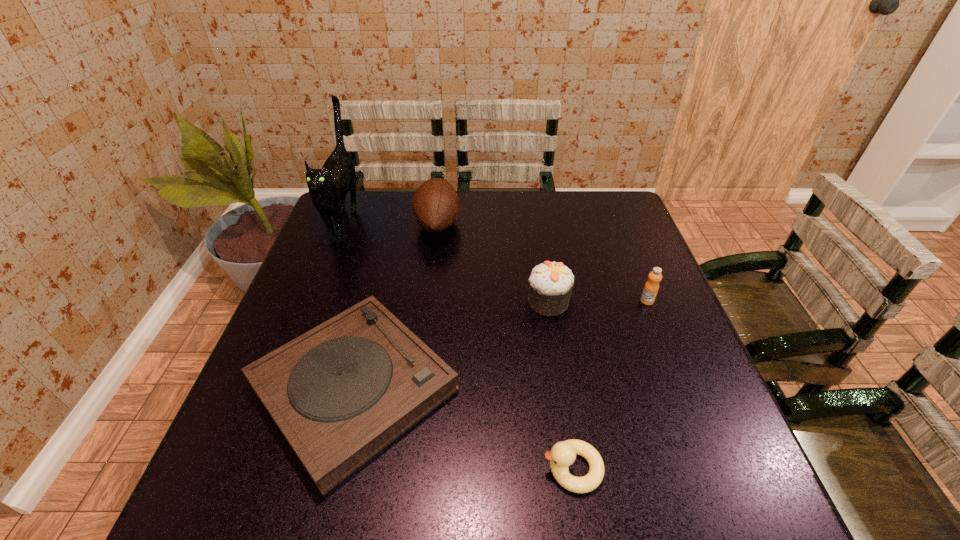
This screenshot has width=960, height=540. Identify the location of vacant area that lies between the tallest object and the rightmost object. (496, 260).

Where is `blank region between the cat and the football`? This screenshot has height=540, width=960. blank region between the cat and the football is located at coordinates (392, 222).

Where is `vacant space that is in between the orange juice and the duckling`? This screenshot has height=540, width=960. vacant space that is in between the orange juice and the duckling is located at coordinates (610, 384).

Locate an element on the screen. free point between the tallest object and the shortest object is located at coordinates (349, 303).

Identify the location of unoccupied position between the football and the shortest object. Image resolution: width=960 pixels, height=540 pixels. (396, 306).

Locate an element on the screen. The width and height of the screenshot is (960, 540). empty space between the cupcake and the phonograph record is located at coordinates (451, 344).

Locate an element on the screen. The width and height of the screenshot is (960, 540). empty space that is in between the duckling and the orange juice is located at coordinates (610, 384).

Where is `free space that is in between the orange juice and the cat`? The width and height of the screenshot is (960, 540). free space that is in between the orange juice and the cat is located at coordinates click(x=496, y=260).

Locate an element on the screen. This screenshot has height=540, width=960. object that is the third closest to the cupcake is located at coordinates (436, 206).

The width and height of the screenshot is (960, 540). What are the coordinates of `object that can be found as the fifth closest to the duckling` in the screenshot? It's located at tap(328, 187).